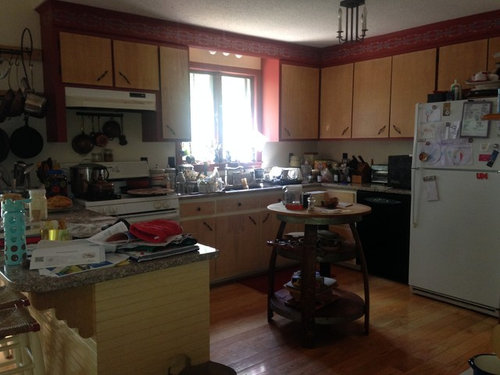
Where is `fridge`? The height and width of the screenshot is (375, 500). fridge is located at coordinates (453, 233).